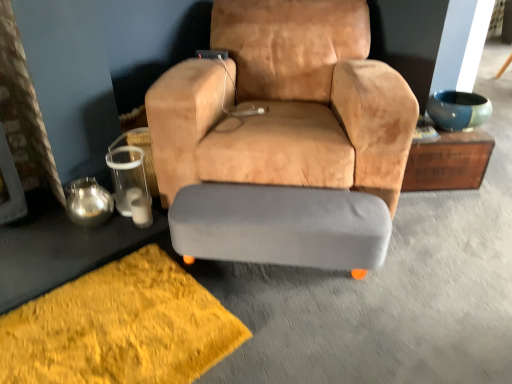
Question: Is gray fabric ottoman at center thinner than wooden chest at upper right, which ranks as the first table in right-to-left order?

Choices:
 (A) no
 (B) yes

Answer: (B)

Question: Is gray fabric ottoman at center taller than wooden chest at upper right, the second table when ordered from bottom to top?

Choices:
 (A) no
 (B) yes

Answer: (A)

Question: From a real-world perspective, does gray fabric ottoman at center stand above wooden chest at upper right, which is the second table in left-to-right order?

Choices:
 (A) no
 (B) yes

Answer: (A)

Question: Can you confirm if gray fabric ottoman at center is shorter than wooden chest at upper right, which ranks as the first table in right-to-left order?

Choices:
 (A) yes
 (B) no

Answer: (A)

Question: Is gray fabric ottoman at center at the left side of wooden chest at upper right, which ranks as the first table in right-to-left order?

Choices:
 (A) yes
 (B) no

Answer: (A)

Question: Is wooden chest at upper right, which appears as the first table when viewed from the top, taller or shorter than gray fabric ottoman at center?

Choices:
 (A) short
 (B) tall

Answer: (B)

Question: Is wooden chest at upper right, which is the second table in left-to-right order, situated inside gray fabric ottoman at center or outside?

Choices:
 (A) inside
 (B) outside

Answer: (B)

Question: From the image's perspective, is wooden chest at upper right, the second table when ordered from bottom to top, located above or below gray fabric ottoman at center?

Choices:
 (A) above
 (B) below

Answer: (A)

Question: Based on their positions, is wooden chest at upper right, which ranks as the first table in right-to-left order, located to the left or right of gray fabric ottoman at center?

Choices:
 (A) left
 (B) right

Answer: (B)

Question: Would you say gray fabric ottoman at center is to the left or to the right of suede tan armchair at center in the picture?

Choices:
 (A) right
 (B) left

Answer: (B)

Question: Considering the positions of point (279, 230) and point (302, 208), is point (279, 230) closer or farther from the camera than point (302, 208)?

Choices:
 (A) closer
 (B) farther

Answer: (A)

Question: Is gray fabric ottoman at center inside or outside of suede tan armchair at center?

Choices:
 (A) inside
 (B) outside

Answer: (B)

Question: From a real-world perspective, is gray fabric ottoman at center physically located above or below suede tan armchair at center?

Choices:
 (A) below
 (B) above

Answer: (A)

Question: From a real-world perspective, is shaggy yellow rug at lower left above or below gray fabric ottoman at center?

Choices:
 (A) below
 (B) above

Answer: (A)

Question: In the image, is shaggy yellow rug at lower left positioned in front of or behind gray fabric ottoman at center?

Choices:
 (A) front
 (B) behind

Answer: (A)